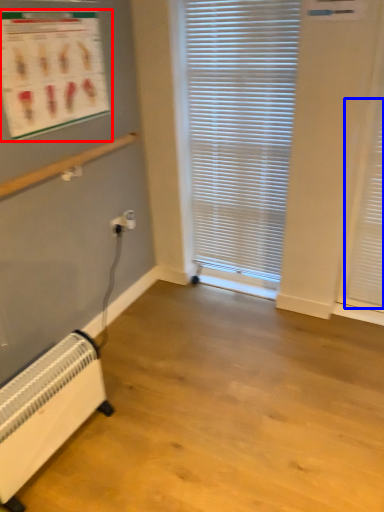
Question: Which object is closer to the camera taking this photo, bulletin board (highlighted by a red box) or shutter (highlighted by a blue box)?

Choices:
 (A) bulletin board
 (B) shutter

Answer: (A)